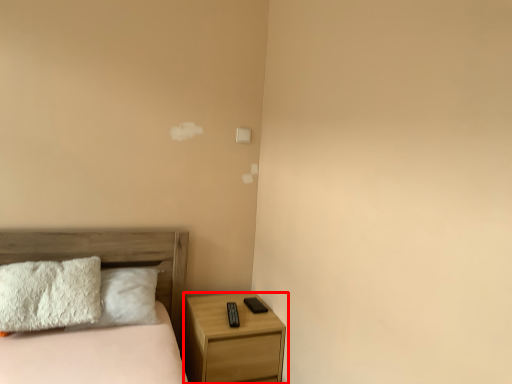
Question: Observing the image, what is the correct spatial positioning of nightstand (annotated by the red box) in reference to bed?

Choices:
 (A) left
 (B) right

Answer: (B)